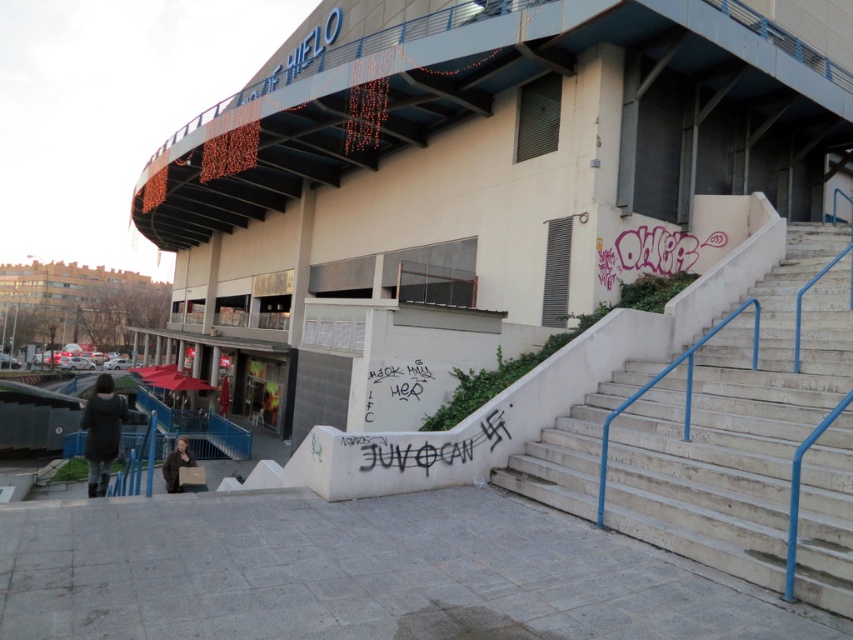
You are a delivery person trying to park your bike near the entrance of the building with the red umbrellas. The white concrete stairs at right and the black graffiti at lower center are in your path. Which object takes up more space in the area?

The black graffiti at lower center takes up more space than the white concrete stairs at right.

You are a delivery person trying to reach the entrance of the building with the red umbrellas. You see the white concrete stairs at right and the black graffiti at lower center. Which object is closer to the entrance?

The white concrete stairs at right is below the black graffiti at lower center, so the stairs are closer to the entrance than the graffiti.